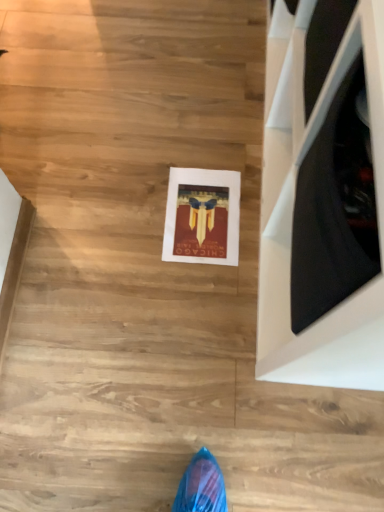
What do you see at coordinates (323, 196) in the screenshot?
I see `white glossy shelf at right` at bounding box center [323, 196].

Measure the distance between point (331, 367) and camera.

Point (331, 367) is 26.61 inches from camera.

Where is `white glossy shelf at right`? The image size is (384, 512). white glossy shelf at right is located at coordinates (323, 196).

Where is `white glossy shelf at right`? This screenshot has width=384, height=512. white glossy shelf at right is located at coordinates point(323,196).